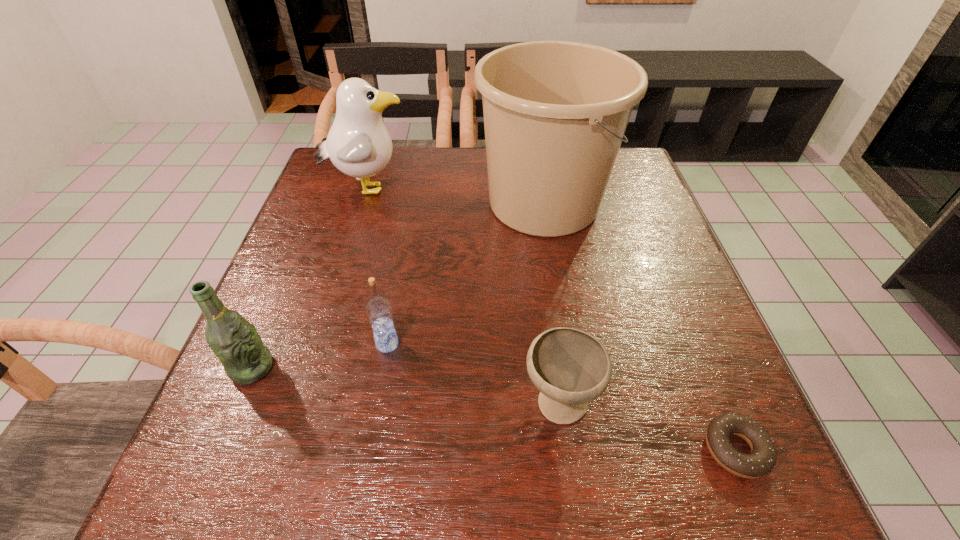
Locate an element on the screen. This screenshot has width=960, height=540. empty space between the third tallest object and the doughnut is located at coordinates (493, 409).

Locate an element on the screen. The width and height of the screenshot is (960, 540). free area in between the shortest object and the chalice is located at coordinates (647, 427).

The width and height of the screenshot is (960, 540). Identify the location of free space between the bucket and the rightmost object. (639, 326).

The height and width of the screenshot is (540, 960). What are the coordinates of `empty space that is in between the rightmost object and the chalice` in the screenshot? It's located at (647, 427).

Find the location of a particular element. Image resolution: width=960 pixels, height=540 pixels. free space that is in between the third tallest object and the bucket is located at coordinates tap(397, 285).

Find the location of a particular element. This screenshot has height=540, width=960. free space between the chalice and the rightmost object is located at coordinates (647, 427).

Find the location of a particular element. The width and height of the screenshot is (960, 540). unoccupied area between the beer bottle and the bucket is located at coordinates (397, 285).

Locate an element on the screen. object that is the fourth closest to the shortest object is located at coordinates (235, 341).

Locate which object is the closest to the vodka. Please provide its 2D coordinates. Your answer should be formatted as a tuple, i.e. [(x, y)], where the tuple contains the x and y coordinates of a point satisfying the conditions above.

[(235, 341)]

This screenshot has height=540, width=960. What are the coordinates of `vacant point that satisfies the following two spatial constraints: 1. on the surface of the chalice; 2. on the left side of the third tallest object` in the screenshot? It's located at (237, 403).